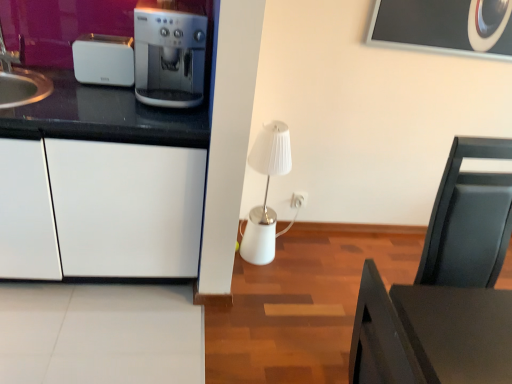
Question: Does white plastic electric outlet at center-right have a greater height compared to white plastic toaster at left?

Choices:
 (A) no
 (B) yes

Answer: (A)

Question: Is white plastic electric outlet at center-right outside of white plastic toaster at left?

Choices:
 (A) no
 (B) yes

Answer: (B)

Question: Is white plastic electric outlet at center-right touching white plastic toaster at left?

Choices:
 (A) yes
 (B) no

Answer: (B)

Question: Is white plastic electric outlet at center-right facing towards white plastic toaster at left?

Choices:
 (A) no
 (B) yes

Answer: (A)

Question: Can you confirm if white plastic electric outlet at center-right is smaller than white plastic toaster at left?

Choices:
 (A) no
 (B) yes

Answer: (B)

Question: From a real-world perspective, relative to satin silver coffee machine at left, is white plastic toaster at left vertically above or below?

Choices:
 (A) below
 (B) above

Answer: (A)

Question: Is white plastic toaster at left spatially inside satin silver coffee machine at left, or outside of it?

Choices:
 (A) outside
 (B) inside

Answer: (A)

Question: In the image, is white plastic toaster at left on the left side or the right side of satin silver coffee machine at left?

Choices:
 (A) left
 (B) right

Answer: (A)

Question: Is point (115, 61) positioned closer to the camera than point (142, 57)?

Choices:
 (A) farther
 (B) closer

Answer: (A)

Question: Is white plastic electric outlet at center-right bigger or smaller than black matte table at lower right?

Choices:
 (A) big
 (B) small

Answer: (B)

Question: In terms of height, does white plastic electric outlet at center-right look taller or shorter compared to black matte table at lower right?

Choices:
 (A) tall
 (B) short

Answer: (B)

Question: Considering their positions, is white plastic electric outlet at center-right located in front of or behind black matte table at lower right?

Choices:
 (A) behind
 (B) front

Answer: (A)

Question: Considering the positions of point (296, 192) and point (430, 370), is point (296, 192) closer or farther from the camera than point (430, 370)?

Choices:
 (A) farther
 (B) closer

Answer: (A)

Question: Looking at their shapes, would you say black matte table at lower right is wider or thinner than white plastic toaster at left?

Choices:
 (A) thin
 (B) wide

Answer: (B)

Question: Considering the positions of point (360, 377) and point (94, 44), is point (360, 377) closer or farther from the camera than point (94, 44)?

Choices:
 (A) farther
 (B) closer

Answer: (B)